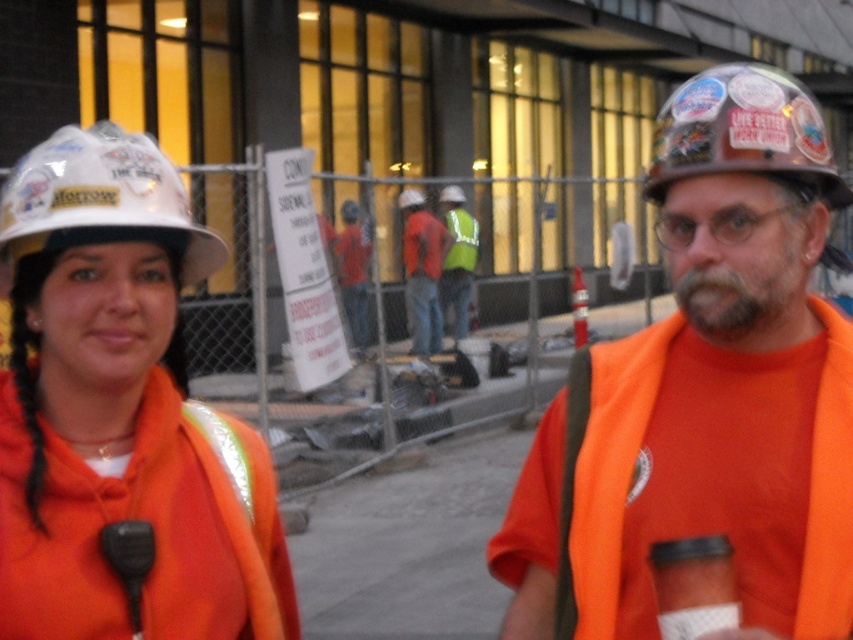
You are a safety inspector at the construction site. You need to ensure that the matte orange shirt at center and the red reflective vest at center are visible from a distance. Which one is more likely to be seen first by someone approaching the site?

A: The red reflective vest at center is more likely to be seen first because it is thicker than the matte orange shirt at center, making it more visible from a distance.

You are a safety inspector at the construction site. You need to determine if the orange fabric safety vest at right is more visible than the reflective yellow vest at center. Based on their positions, which one is closer to the observer?

The orange fabric safety vest at right is closer to the viewer than the reflective yellow vest at center, so it would appear more visible to the observer.

You are standing at the construction site and want to reach the point marked at coordinates point [633,500]. If you can walk 6 feet in one minute, how long will it take you to reach that point?

The distance to point [633,500] is 5.81 feet. Since you can walk 6 feet per minute, it will take approximately 58 seconds to reach the point.